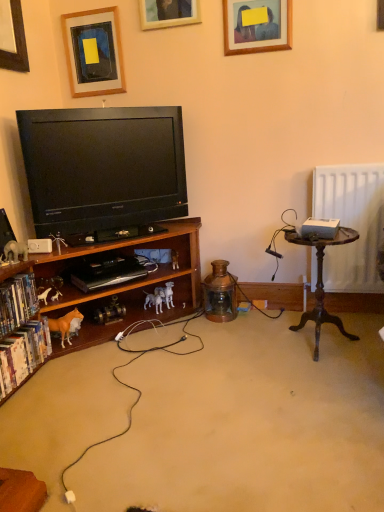
The image size is (384, 512). Find the location of `vacant area that lies between white plastic dog at lower center, placed as the 4th toy when sorted from front to back, and copper glass lantern at center, which is the first toy from right to left`. vacant area that lies between white plastic dog at lower center, placed as the 4th toy when sorted from front to back, and copper glass lantern at center, which is the first toy from right to left is located at coordinates (188, 318).